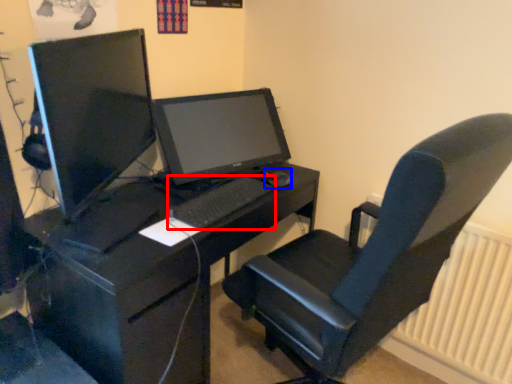
Question: Which of the following is the farthest to the observer, computer keyboard (highlighted by a red box) or mouse (highlighted by a blue box)?

Choices:
 (A) computer keyboard
 (B) mouse

Answer: (B)